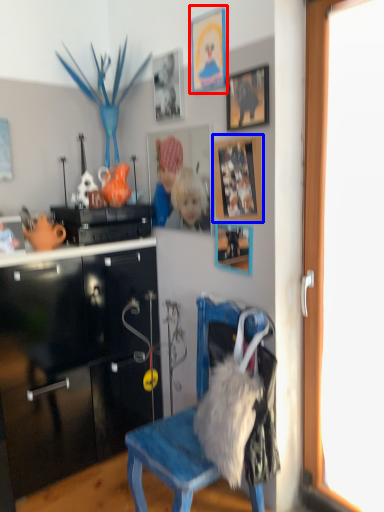
Question: Which of the following is the farthest to the observer, picture frame (highlighted by a red box) or picture frame (highlighted by a blue box)?

Choices:
 (A) picture frame
 (B) picture frame

Answer: (A)